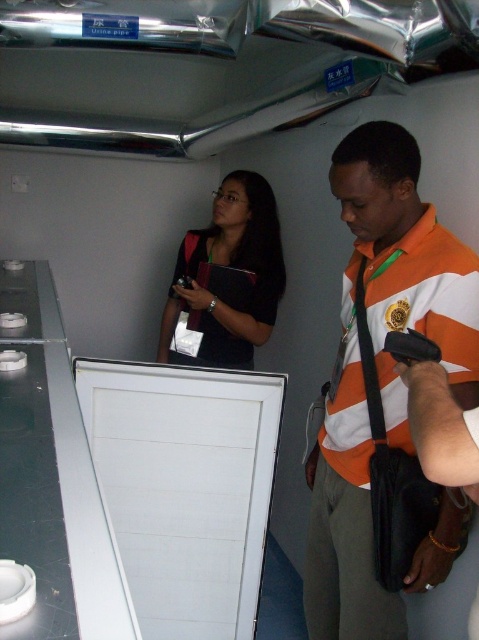
Is orange striped shirt at center to the left of black matte laptop at upper center from the viewer's perspective?

In fact, orange striped shirt at center is to the right of black matte laptop at upper center.

Is point (423, 228) closer to camera compared to point (277, 275)?

Yes.

Identify the location of orange striped shirt at center. (379, 369).